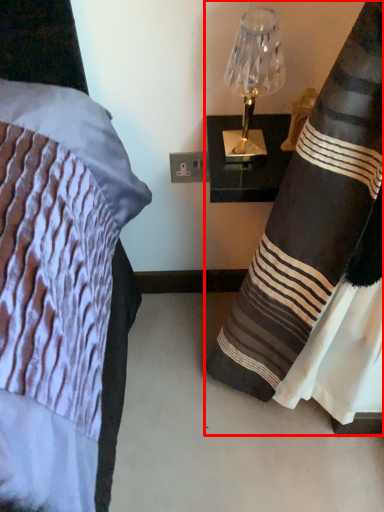
Question: From the image's perspective, where is curtain (annotated by the red box) located in relation to lamp in the image?

Choices:
 (A) below
 (B) above

Answer: (A)